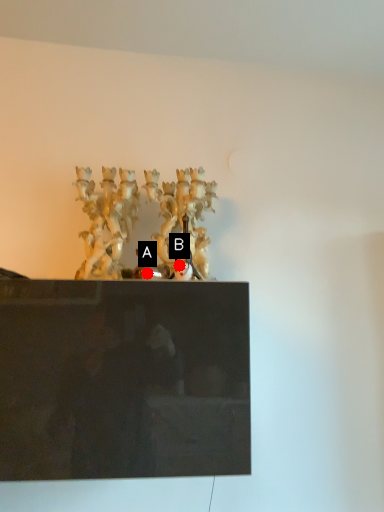
Question: Two points are circled on the image, labeled by A and B beside each circle. Which point is farther to the camera?

Choices:
 (A) A is further
 (B) B is further

Answer: (B)